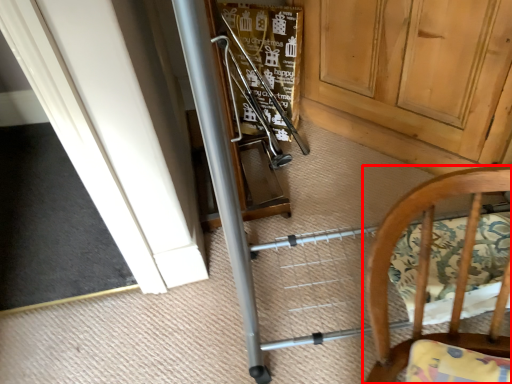
Question: Where is chair (annotated by the red box) located in relation to door in the image?

Choices:
 (A) right
 (B) left

Answer: (B)